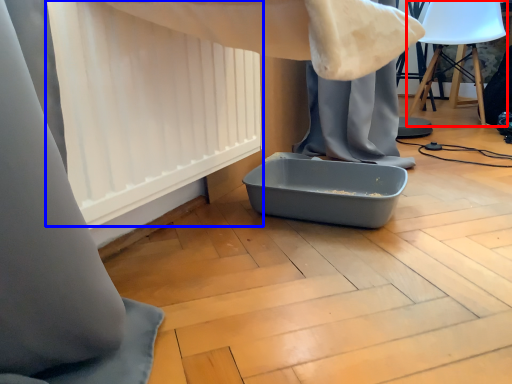
Question: Which of the following is the closest to the observer, swivel chair (highlighted by a red box) or curtain (highlighted by a blue box)?

Choices:
 (A) swivel chair
 (B) curtain

Answer: (B)